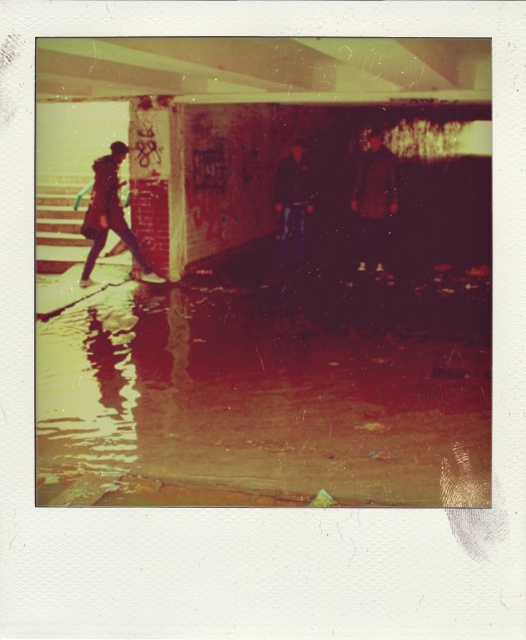
Who is higher up, matte brown coat at center or matte black jacket at left?

matte brown coat at center is higher up.

Who is shorter, matte brown coat at center or matte black jacket at left?

Standing shorter between the two is matte brown coat at center.

Where is `matte brown coat at center`? This screenshot has width=526, height=640. matte brown coat at center is located at coordinates (373, 202).

Find the location of a particular element. Image resolution: width=526 pixels, height=640 pixels. matte brown coat at center is located at coordinates (373, 202).

Does matte black jacket at left have a greater width compared to dark blue fabric jacket at center?

Yes, matte black jacket at left is wider than dark blue fabric jacket at center.

Can you confirm if matte black jacket at left is smaller than dark blue fabric jacket at center?

Incorrect, matte black jacket at left is not smaller in size than dark blue fabric jacket at center.

Is point (115, 182) farther from camera compared to point (288, 248)?

No, it is not.

The height and width of the screenshot is (640, 526). Find the location of `matte black jacket at left`. matte black jacket at left is located at coordinates (109, 214).

Between wet concrete pavement at lower center and dark blue fabric jacket at center, which one has more height?

Standing taller between the two is wet concrete pavement at lower center.

Locate an element on the screen. The height and width of the screenshot is (640, 526). wet concrete pavement at lower center is located at coordinates tap(266, 396).